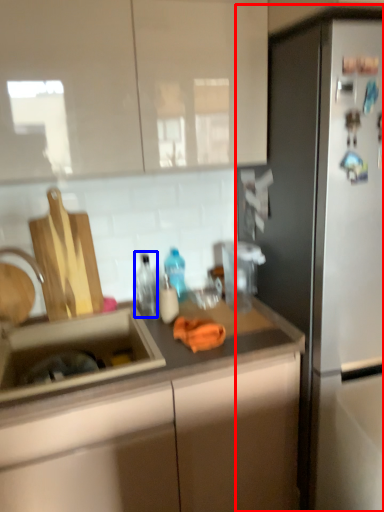
Question: Among these objects, which one is nearest to the camera, refrigerator (highlighted by a red box) or bottle (highlighted by a blue box)?

Choices:
 (A) refrigerator
 (B) bottle

Answer: (A)